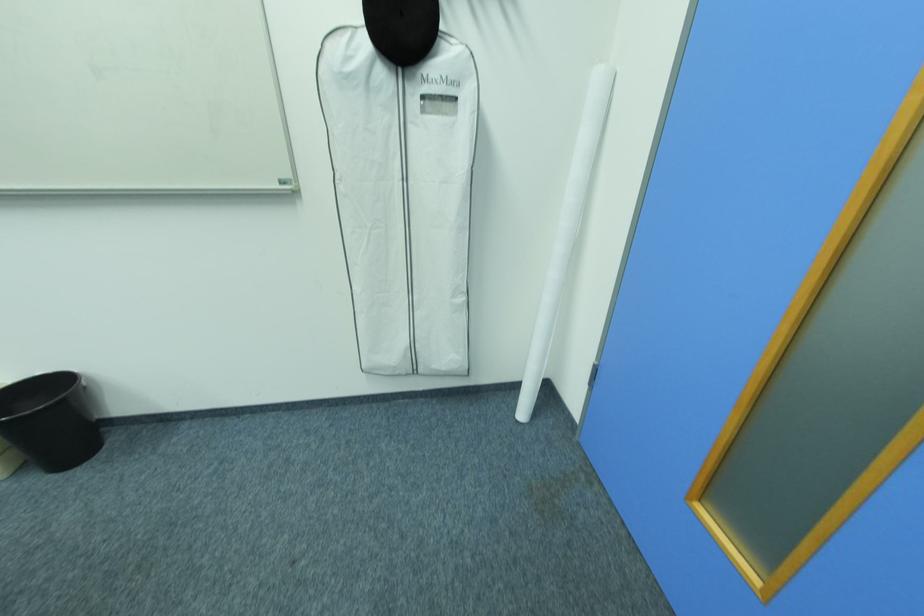
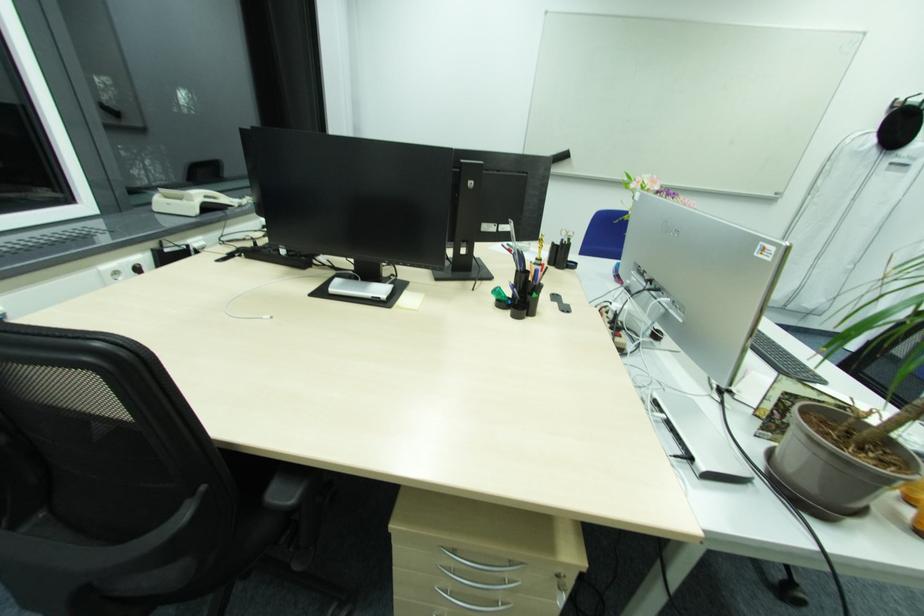
In a continuous first-person perspective shot, in which direction is the camera moving?

The movement direction of the cameraman is left, backward.